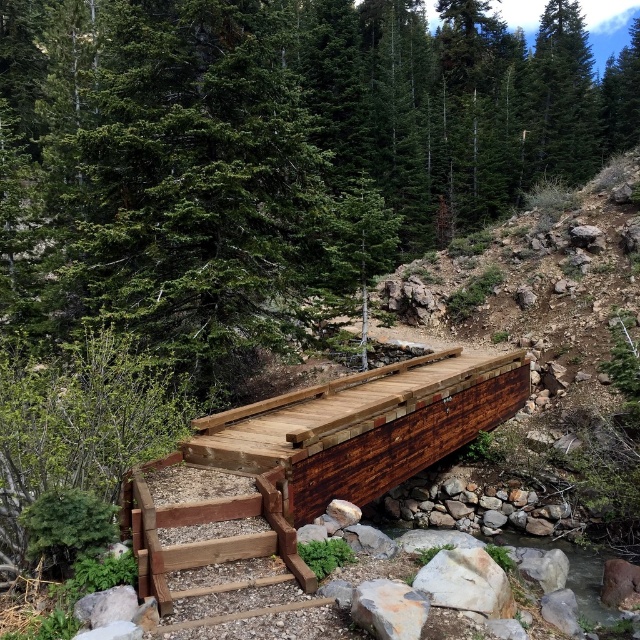
Who is more distant from viewer, (406, 33) or (225, 500)?

Positioned behind is point (406, 33).

Where is `green matte tree at center`? This screenshot has width=640, height=640. green matte tree at center is located at coordinates (272, 150).